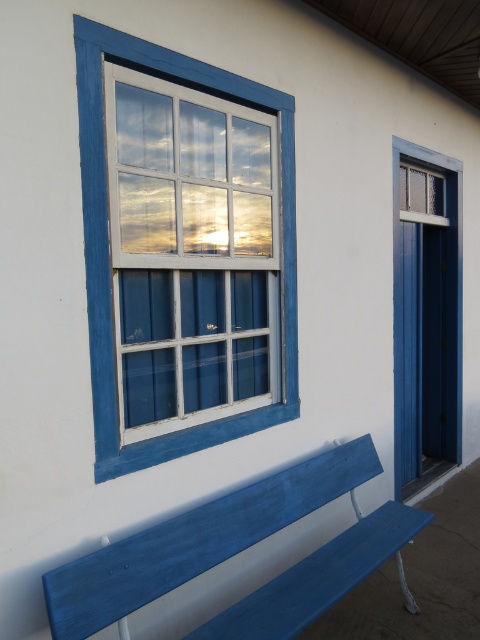
You are standing in front of the building and want to enter through the door. Which object, the blue painted wood window at upper left or the blue painted wood door at right, is blocking your direct path to the door?

The blue painted wood window at upper left is in front of the blue painted wood door at right, so it is blocking your direct path to the door.

You are standing in front of the building and notice two points marked on the exterior wall. The first point is at coordinates point (x=269, y=580) and the second is at point (x=417, y=170). Which point is nearer to your current position?

Point (x=269, y=580) is closer to the camera than point (x=417, y=170), so the first point is nearer to your current position.

Based on the photo, you are standing at the camera position and want to sit on the matte blue bench at lower center. How many steps do you need to take to reach it if each step covers 1.5 feet?

The matte blue bench at lower center and camera are 5.90 feet apart. Since each step covers 1.5 feet, you would need to take approximately 4 steps to reach the bench.